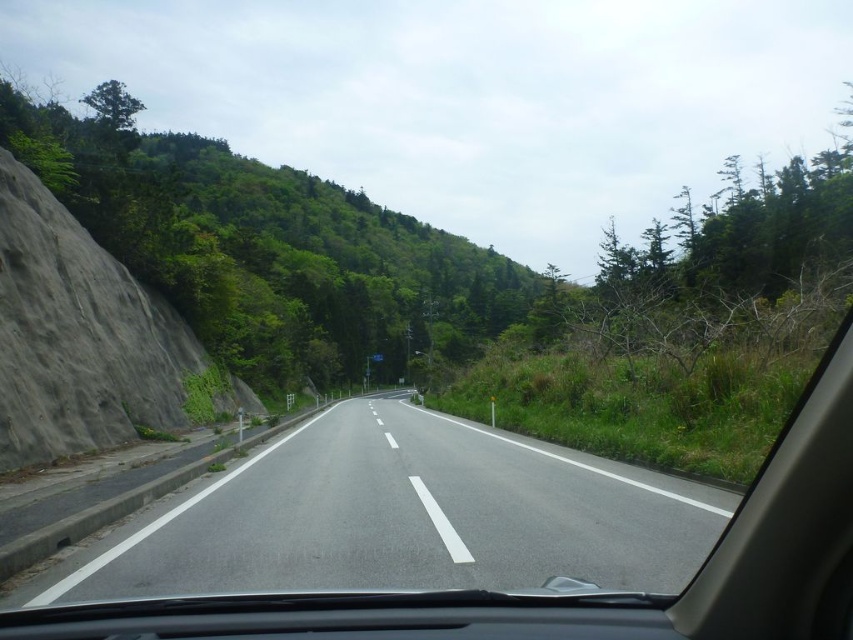
Question: Which point is farther to the camera?

Choices:
 (A) gray rough rock at left
 (B) green leafy tree at left
 (C) asphalt road at center

Answer: (B)

Question: Is green leafy tree at left wider than gray rough rock at left?

Choices:
 (A) yes
 (B) no

Answer: (A)

Question: Which of the following is the farthest from the observer?

Choices:
 (A) (421, 490)
 (B) (213, 282)

Answer: (B)

Question: Which object is closer to the camera taking this photo?

Choices:
 (A) asphalt road at center
 (B) green leafy tree at left
 (C) gray rough rock at left

Answer: (A)

Question: Is asphalt road at center thinner than green leafy tree at left?

Choices:
 (A) yes
 (B) no

Answer: (A)

Question: Is asphalt road at center bigger than green leafy tree at left?

Choices:
 (A) yes
 (B) no

Answer: (B)